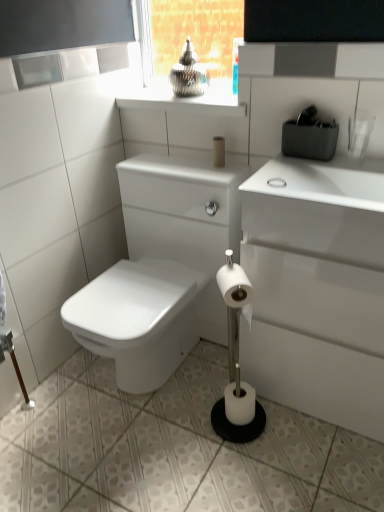
Question: Relative to white matte toilet paper at center, the 2th toilet paper from the bottom, is white matte toilet paper at center, which is the second toilet paper in front-to-back order, in front or behind?

Choices:
 (A) behind
 (B) front

Answer: (A)

Question: Is point (236, 415) positioned closer to the camera than point (241, 293)?

Choices:
 (A) farther
 (B) closer

Answer: (A)

Question: Estimate the real-world distances between objects in this image. Which object is closer to the matte beige toilet paper at center, positioned as the first toilet paper in top-to-bottom order?

Choices:
 (A) metallic silver at upper center
 (B) white matte toilet paper at center, the 2th toilet paper from the bottom
 (C) white glossy toilet at lower left
 (D) white glossy ceramic tile at lower center
 (E) white matte toilet paper at center, the 1th toilet paper when ordered from bottom to top

Answer: (A)

Question: Which object is the closest to the white glossy ceramic tile at lower center?

Choices:
 (A) metallic silver at upper center
 (B) matte beige toilet paper at center, which ranks as the third toilet paper in front-to-back order
 (C) white matte toilet paper at center, which is the second toilet paper in front-to-back order
 (D) white glossy toilet at lower left
 (E) white matte toilet paper at center, positioned as the 2th toilet paper in top-to-bottom order

Answer: (C)